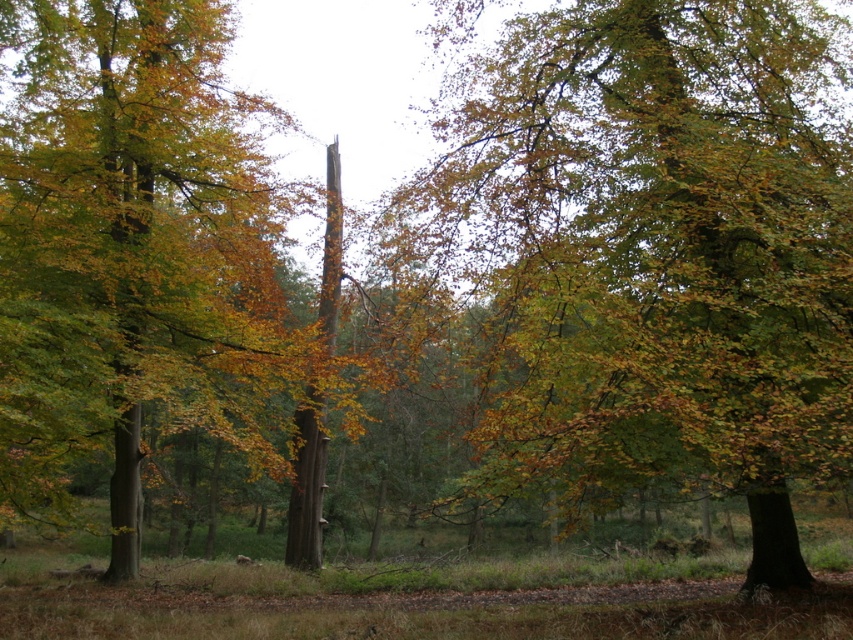
Between point (711, 448) and point (51, 397), which one is positioned behind?

Point (51, 397)

Who is more forward, [640,291] or [165,212]?

Positioned in front is point [640,291].

At what (x,y) coordinates should I click in order to perform the action: click on green leafy tree at center. Please return your answer as a coordinate pair (x, y). This screenshot has height=640, width=853. Looking at the image, I should click on (656, 253).